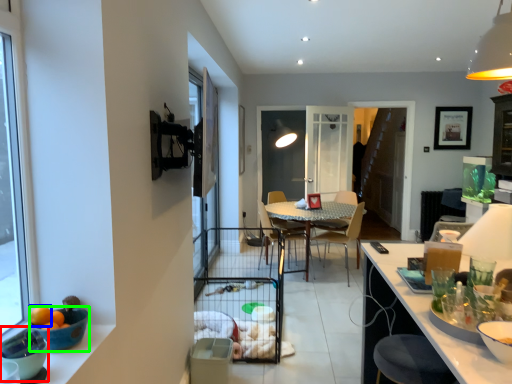
Question: Which object is the farthest from bowl (highlighted by a red box)? Choose among these: orange (highlighted by a blue box) or bowl (highlighted by a green box).

Choices:
 (A) orange
 (B) bowl

Answer: (B)